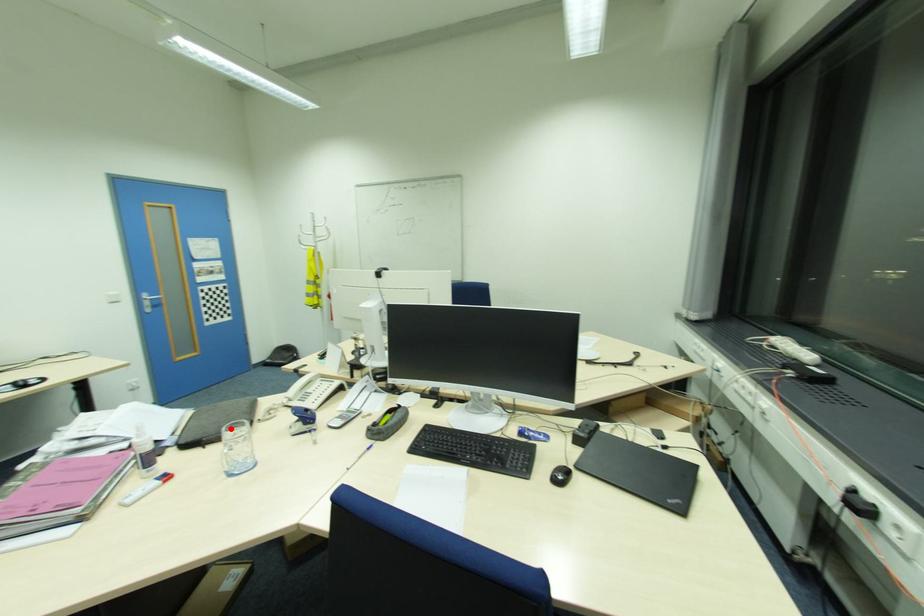
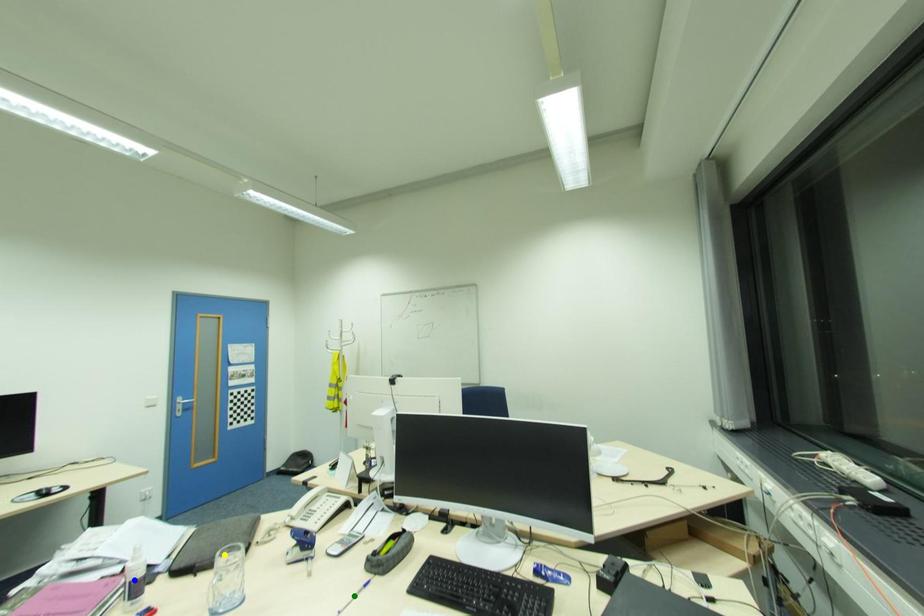
Question: I am providing you with two images of the same scene from different viewpoints. A red point is marked on the first image. You are given multiple points on the second image. In image 2, which mark is for the same physical point as the one in image 1?

Choices:
 (A) blue point
 (B) green point
 (C) yellow point

Answer: (C)